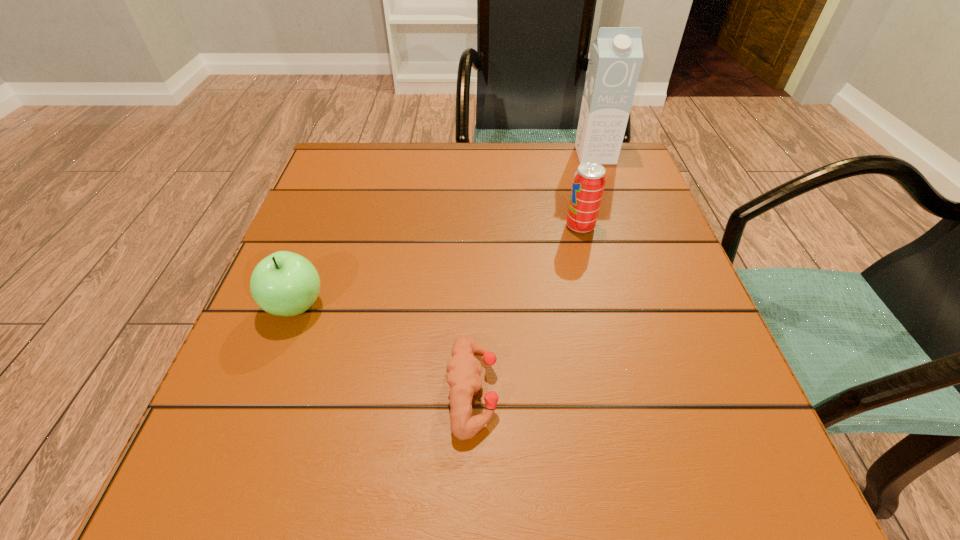
The height and width of the screenshot is (540, 960). In order to click on vacant space situated 0.160m on the right of the leftmost object in this screenshot , I will do `click(420, 306)`.

You are a GUI agent. You are given a task and a screenshot of the screen. Output one action in this format:
    pyautogui.click(x=<x>, y=<y>)
    Task: Click on the free space located 0.350m with the gloves of the nearest object facing forward
    Image resolution: width=960 pixels, height=540 pixels.
    Given the screenshot: What is the action you would take?
    pyautogui.click(x=740, y=391)

Identify the location of object that is at the far edge. (616, 56).

Locate an element on the screen. The height and width of the screenshot is (540, 960). object that is positioned at the near edge is located at coordinates (463, 370).

Image resolution: width=960 pixels, height=540 pixels. Find the location of `object positioned at the left edge`. object positioned at the left edge is located at coordinates (284, 283).

I want to click on carton present at the right edge, so click(616, 56).

Locate an element on the screen. The image size is (960, 540). soda can that is at the right edge is located at coordinates (589, 180).

The image size is (960, 540). Find the location of `object that is at the far right corner`. object that is at the far right corner is located at coordinates (616, 56).

You are a GUI agent. You are given a task and a screenshot of the screen. Output one action in this format:
    pyautogui.click(x=<x>, y=<y>)
    Task: Click on the blank area at the far edge
    Image resolution: width=960 pixels, height=540 pixels.
    Given the screenshot: What is the action you would take?
    pyautogui.click(x=411, y=167)

This screenshot has height=540, width=960. In the image, there is a desktop. What are the coordinates of `vacant region at the near edge` in the screenshot? It's located at (486, 447).